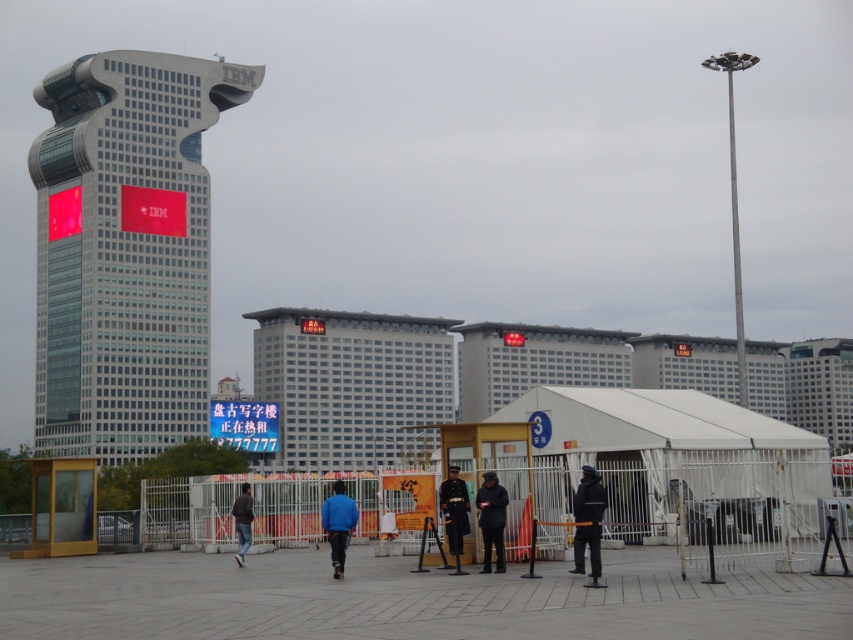
You are a photographer planning to take a picture of the white glass building at center and the dark blue jacket at center from the same angle. Which object will occupy more space in your photo?

The white glass building at center is bigger than the dark blue jacket at center, so it will occupy more space in the photo.

You are standing at the center of the image. Which direction should you move to reach the white glass building at center?

The white glass building at center is already at the center of the image, so you don not need to move in any direction to reach it.

You are a photographer trying to capture the white glass building at center and the blue matte jacket at center in a single frame. Based on their sizes, which object will appear larger in your photo?

The white glass building at center will appear larger in the photo since its width surpasses that of the blue matte jacket at center.